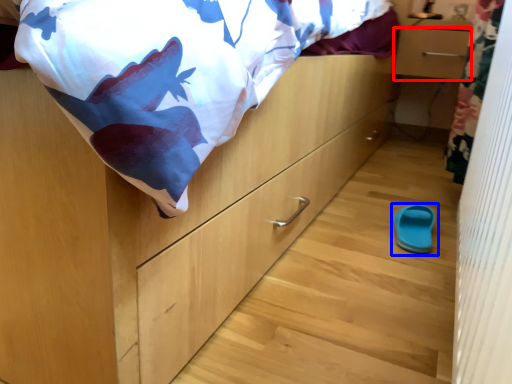
Question: Which object appears closest to the camera in this image, drawer (highlighted by a red box) or footwear (highlighted by a blue box)?

Choices:
 (A) drawer
 (B) footwear

Answer: (B)